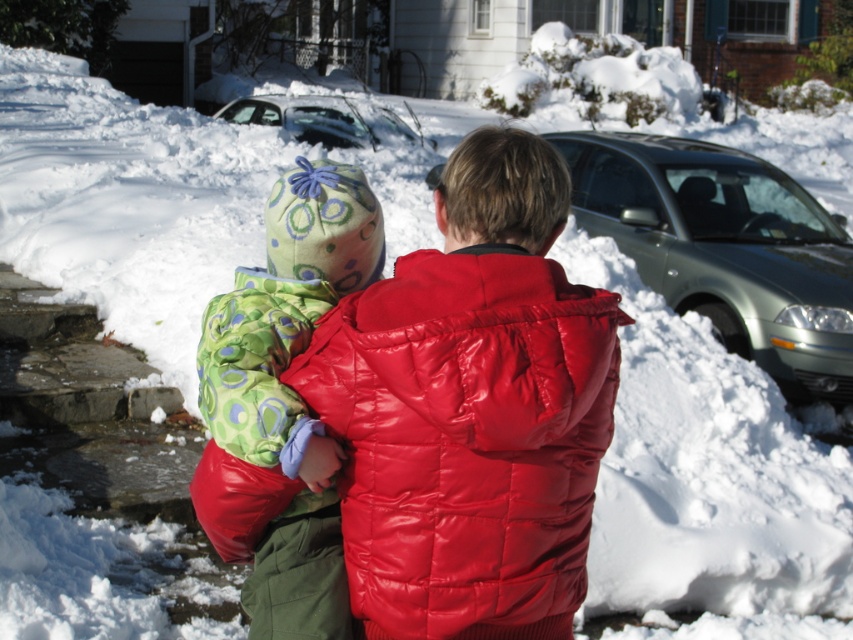
Between shiny red jacket at center and silver metallic car at upper center, which one has more height?

silver metallic car at upper center

Does shiny red jacket at center lie behind silver metallic car at upper center?

That is False.

This screenshot has height=640, width=853. Find the location of `shiny red jacket at center`. shiny red jacket at center is located at coordinates (466, 440).

Is the position of shiny red jacket at center less distant than that of silver metallic sedan at right?

Yes, it is.

Between point (560, 570) and point (782, 317), which one is positioned behind?

The point (782, 317) is behind.

Identify the location of shiny red jacket at center. (466, 440).

You are a GUI agent. You are given a task and a screenshot of the screen. Output one action in this format:
    pyautogui.click(x=<x>, y=<y>)
    Task: Click on the shiny red jacket at center
    The height and width of the screenshot is (640, 853).
    Given the screenshot: What is the action you would take?
    pyautogui.click(x=466, y=440)

Is point (668, 188) behind point (308, 321)?

Yes, it is.

Is point (697, 204) farther from camera compared to point (303, 502)?

That is True.

This screenshot has height=640, width=853. I want to click on silver metallic sedan at right, so click(724, 248).